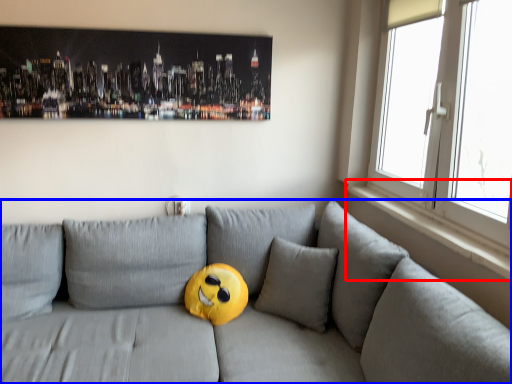
Question: Which point is further to the camera, window sill (highlighted by a red box) or studio couch (highlighted by a blue box)?

Choices:
 (A) window sill
 (B) studio couch

Answer: (A)